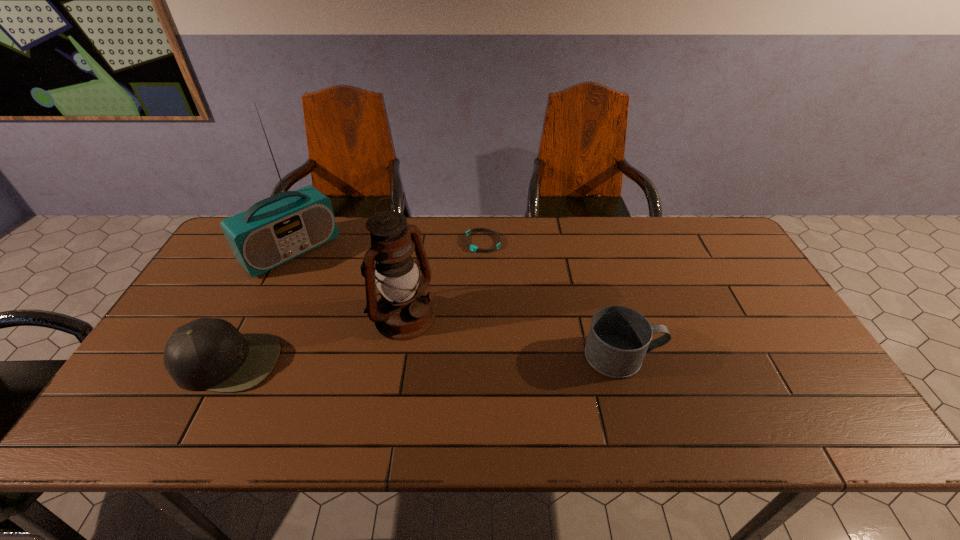
I want to click on free space located 0.100m on the front panel of the radio receiver, so click(330, 287).

Where is `free space located 0.150m on the side of the second tallest object, there is a wick adjustment knob`? The height and width of the screenshot is (540, 960). free space located 0.150m on the side of the second tallest object, there is a wick adjustment knob is located at coordinates (467, 364).

Where is `free spot located 0.280m on the side of the second tallest object, there is a wick adjustment knob`? The image size is (960, 540). free spot located 0.280m on the side of the second tallest object, there is a wick adjustment knob is located at coordinates (507, 394).

This screenshot has width=960, height=540. In order to click on vacant area situated on the side of the second tallest object, there is a wick adjustment knob in this screenshot , I will do `click(514, 400)`.

This screenshot has height=540, width=960. What are the coordinates of `vacant space located on the buckle of the shortest object` in the screenshot? It's located at (415, 336).

Locate an element on the screen. vacant region located on the buckle of the shortest object is located at coordinates (455, 279).

Find the location of `free space located on the buckle of the shortest object`. free space located on the buckle of the shortest object is located at coordinates (454, 281).

The height and width of the screenshot is (540, 960). Find the location of `radio receiver present at the far edge`. radio receiver present at the far edge is located at coordinates (279, 228).

Find the location of `wristband situated at the far edge`. wristband situated at the far edge is located at coordinates (473, 248).

Where is `cap that is at the near edge`? This screenshot has height=540, width=960. cap that is at the near edge is located at coordinates (210, 354).